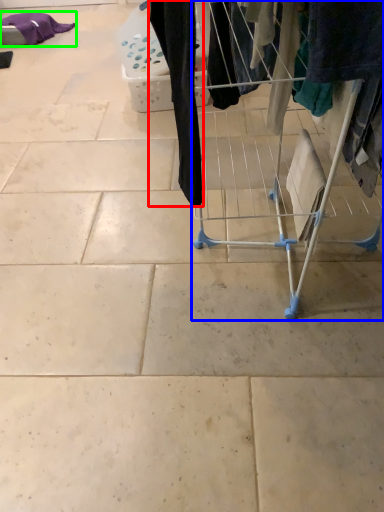
Question: Based on their relative distances, which object is farther from clothing (highlighted by a red box)? Choose from furniture (highlighted by a blue box) and clothing (highlighted by a green box).

Choices:
 (A) furniture
 (B) clothing

Answer: (B)